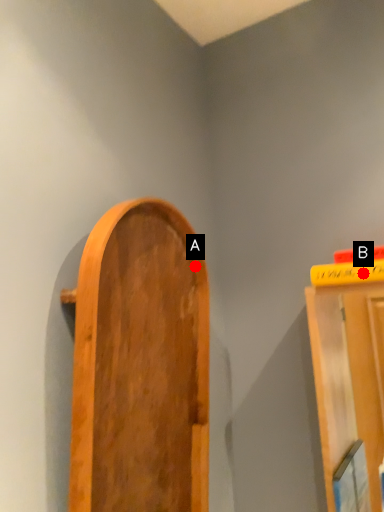
Question: Two points are circled on the image, labeled by A and B beside each circle. Which point appears closest to the camera in this image?

Choices:
 (A) A is closer
 (B) B is closer

Answer: (B)